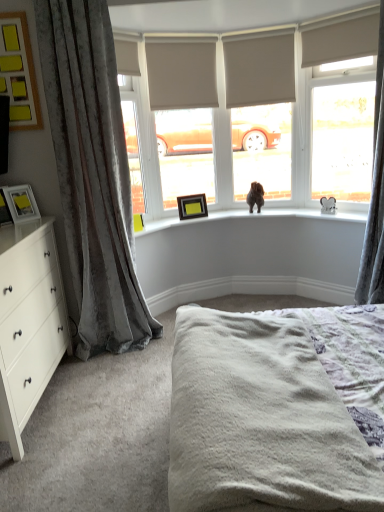
Question: From a real-world perspective, is brown wooden picture frame at upper center, the third picture frame from the bottom, above or below yellow matte picture frame at upper left, which is the third picture frame in left-to-right order?

Choices:
 (A) below
 (B) above

Answer: (A)

Question: Is brown wooden picture frame at upper center, acting as the 1th picture frame starting from the right, inside the boundaries of yellow matte picture frame at upper left, which is the third picture frame in left-to-right order, or outside?

Choices:
 (A) inside
 (B) outside

Answer: (B)

Question: Which object is positioned farthest from the matte black picture frame at left, positioned as the 3th picture frame in top-to-bottom order?

Choices:
 (A) white wood chest of drawers at left
 (B) brown wooden picture frame at upper center, acting as the 1th picture frame starting from the right
 (C) white plush toy at upper right, marked as the second animal in a left-to-right arrangement
 (D) brown furry dog at center, placed as the second animal when sorted from right to left
 (E) beige fabric blind at upper center, which appears as the second blind when viewed from the right

Answer: (C)

Question: Considering the real-world distances, which object is closest to the beige fabric blind at upper right, placed as the third blind when sorted from left to right?

Choices:
 (A) matte black picture frame at left, the second picture frame viewed from the left
 (B) brown furry dog at center, which is the 2th animal in front-to-back order
 (C) velvet gray curtain at right, which appears as the 1th curtain when viewed from the right
 (D) white wood chest of drawers at left
 (E) yellow matte picture frame at upper left, the 1th picture frame from the front

Answer: (C)